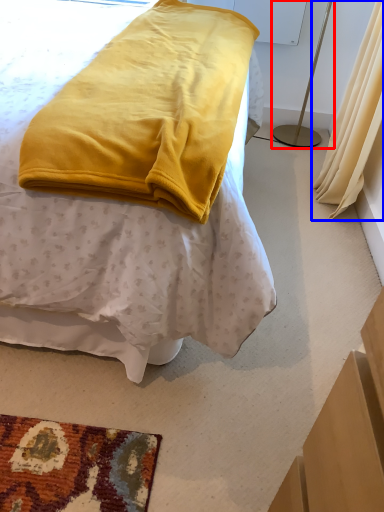
Question: Which of the following is the closest to the observer, bedside lamp (highlighted by a red box) or curtain (highlighted by a blue box)?

Choices:
 (A) bedside lamp
 (B) curtain

Answer: (B)